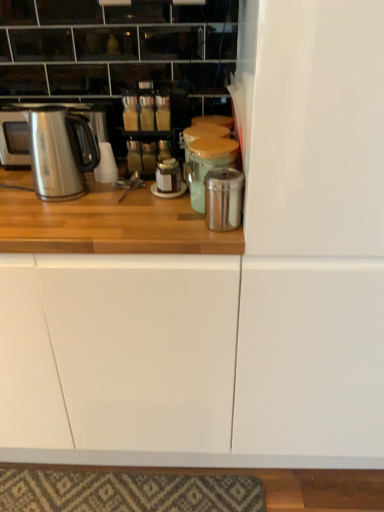
The image size is (384, 512). Identify the location of stainless steel kettle at left. (14, 138).

Where is `metallic silver fridge at center-right`? Image resolution: width=384 pixels, height=512 pixels. metallic silver fridge at center-right is located at coordinates (312, 231).

I want to click on the 2nd appliance in front of the stainless steel kettle at left, counting from the anchor's position, so click(223, 198).

Is stainless steel kettle at left bigger or smaller than shiny metallic canister at center, arranged as the first appliance when viewed from the front?

stainless steel kettle at left is bigger than shiny metallic canister at center, arranged as the first appliance when viewed from the front.

Does stainless steel kettle at left lie in front of shiny metallic canister at center, the 2th appliance viewed from the back?

No, the depth of stainless steel kettle at left is greater than that of shiny metallic canister at center, the 2th appliance viewed from the back.

Is shiny metallic canister at center, the 2th appliance viewed from the back, at the back of stainless steel kettle at left?

That's not correct — stainless steel kettle at left is not looking away from shiny metallic canister at center, the 2th appliance viewed from the back.

In the image, is metallic silver canister at center, which is counted as the 1th appliance, starting from the back, on the left side or the right side of shiny metallic canister at center, arranged as the first appliance when viewed from the front?

From the image, it's evident that metallic silver canister at center, which is counted as the 1th appliance, starting from the back, is to the left of shiny metallic canister at center, arranged as the first appliance when viewed from the front.

Does metallic silver canister at center, which is counted as the 1th appliance, starting from the back, touch shiny metallic canister at center, arranged as the first appliance when viewed from the front?

Yes, metallic silver canister at center, which is counted as the 1th appliance, starting from the back, is with shiny metallic canister at center, arranged as the first appliance when viewed from the front.

Consider the image. Which is nearer, (197,172) or (220,224)?

Point (197,172).

From the image's perspective, does metallic silver canister at center, which is counted as the 1th appliance, starting from the back, appear higher than shiny metallic canister at center, arranged as the first appliance when viewed from the front?

Yes, from the image's perspective, metallic silver canister at center, which is counted as the 1th appliance, starting from the back, is above shiny metallic canister at center, arranged as the first appliance when viewed from the front.

In order to click on fridge located underneath the stainless steel kettle at left (from a real-world perspective) in this screenshot , I will do `click(312, 231)`.

Considering the sizes of objects stainless steel kettle at left and metallic silver fridge at center-right in the image provided, who is thinner, stainless steel kettle at left or metallic silver fridge at center-right?

With smaller width is stainless steel kettle at left.

Are stainless steel kettle at left and metallic silver fridge at center-right making contact?

stainless steel kettle at left and metallic silver fridge at center-right are clearly separated.

Can we say stainless steel kettle at left lies outside metallic silver fridge at center-right?

stainless steel kettle at left lies outside metallic silver fridge at center-right's area.

Is metallic silver canister at center, which is counted as the 1th appliance, starting from the back, inside the boundaries of stainless steel kettle at left, or outside?

metallic silver canister at center, which is counted as the 1th appliance, starting from the back, lies outside stainless steel kettle at left.

Between metallic silver canister at center, the second appliance from the front, and stainless steel kettle at left, which one appears on the right side from the viewer's perspective?

From the viewer's perspective, metallic silver canister at center, the second appliance from the front, appears more on the right side.

Can you confirm if metallic silver canister at center, which is counted as the 1th appliance, starting from the back, is wider than stainless steel kettle at left?

In fact, metallic silver canister at center, which is counted as the 1th appliance, starting from the back, might be narrower than stainless steel kettle at left.

From a real-world perspective, does metallic silver canister at center, which is counted as the 1th appliance, starting from the back, sit lower than stainless steel kettle at left?

Yes, from a real-world perspective, metallic silver canister at center, which is counted as the 1th appliance, starting from the back, is under stainless steel kettle at left.

At what (x,y) coordinates should I click in order to perform the action: click on the 1st appliance behind the metallic silver fridge at center-right, counting from the anchor's position. Please return your answer as a coordinate pair (x, y). Looking at the image, I should click on (223, 198).

Is metallic silver fridge at center-right looking in the opposite direction of shiny metallic canister at center, the 2th appliance viewed from the back?

metallic silver fridge at center-right is not turned away from shiny metallic canister at center, the 2th appliance viewed from the back.

Between metallic silver fridge at center-right and shiny metallic canister at center, arranged as the first appliance when viewed from the front, which one appears on the left side from the viewer's perspective?

From the viewer's perspective, shiny metallic canister at center, arranged as the first appliance when viewed from the front, appears more on the left side.

Is metallic silver fridge at center-right taller or shorter than metallic silver canister at center, the second appliance from the front?

Clearly, metallic silver fridge at center-right is taller compared to metallic silver canister at center, the second appliance from the front.

From the image's perspective, is metallic silver fridge at center-right below metallic silver canister at center, which is counted as the 1th appliance, starting from the back?

Indeed, from the image's perspective, metallic silver fridge at center-right is shown beneath metallic silver canister at center, which is counted as the 1th appliance, starting from the back.

Between metallic silver fridge at center-right and metallic silver canister at center, the second appliance from the front, which one appears on the right side from the viewer's perspective?

metallic silver fridge at center-right.

Are shiny metallic canister at center, arranged as the first appliance when viewed from the front, and stainless steel kettle at left located far from each other?

No, shiny metallic canister at center, arranged as the first appliance when viewed from the front, is not far from stainless steel kettle at left.

Who is shorter, shiny metallic canister at center, arranged as the first appliance when viewed from the front, or stainless steel kettle at left?

shiny metallic canister at center, arranged as the first appliance when viewed from the front.

Is shiny metallic canister at center, the 2th appliance viewed from the back, thinner than stainless steel kettle at left?

Correct, the width of shiny metallic canister at center, the 2th appliance viewed from the back, is less than that of stainless steel kettle at left.

Relative to stainless steel kettle at left, is shiny metallic canister at center, arranged as the first appliance when viewed from the front, in front or behind?

shiny metallic canister at center, arranged as the first appliance when viewed from the front, is in front of stainless steel kettle at left.

Locate an element on the screen. The image size is (384, 512). the 2nd appliance counting from the right of the stainless steel kettle at left is located at coordinates (223, 198).

The image size is (384, 512). I want to click on appliance below the metallic silver canister at center, which is counted as the 1th appliance, starting from the back (from the image's perspective), so click(x=223, y=198).

Based on their spatial positions, is metallic silver canister at center, which is counted as the 1th appliance, starting from the back, or shiny metallic canister at center, arranged as the first appliance when viewed from the front, further from metallic silver fridge at center-right?

metallic silver canister at center, which is counted as the 1th appliance, starting from the back, is positioned further to the anchor metallic silver fridge at center-right.

Based on the photo, from the image, which object appears to be nearer to metallic silver fridge at center-right, metallic silver canister at center, which is counted as the 1th appliance, starting from the back, or stainless steel kettle at left?

metallic silver canister at center, which is counted as the 1th appliance, starting from the back.

From the image, which object appears to be farther from stainless steel kettle at left, shiny metallic canister at center, arranged as the first appliance when viewed from the front, or metallic silver fridge at center-right?

metallic silver fridge at center-right is positioned further to the anchor stainless steel kettle at left.

Looking at the image, which one is located further to metallic silver canister at center, the second appliance from the front, metallic silver fridge at center-right or stainless steel kettle at left?

stainless steel kettle at left is further to metallic silver canister at center, the second appliance from the front.

Which object lies nearer to the anchor point metallic silver canister at center, which is counted as the 1th appliance, starting from the back, stainless steel kettle at left or shiny metallic canister at center, the 2th appliance viewed from the back?

shiny metallic canister at center, the 2th appliance viewed from the back, lies closer to metallic silver canister at center, which is counted as the 1th appliance, starting from the back, than the other object.

Looking at the image, which one is located closer to metallic silver fridge at center-right, stainless steel kettle at left or metallic silver canister at center, which is counted as the 1th appliance, starting from the back?

metallic silver canister at center, which is counted as the 1th appliance, starting from the back, lies closer to metallic silver fridge at center-right than the other object.

When comparing their distances from shiny metallic canister at center, the 2th appliance viewed from the back, does metallic silver fridge at center-right or metallic silver canister at center, which is counted as the 1th appliance, starting from the back, seem further?

metallic silver fridge at center-right.

Estimate the real-world distances between objects in this image. Which object is further from shiny metallic canister at center, arranged as the first appliance when viewed from the front, metallic silver fridge at center-right or stainless steel kettle at left?

The object further to shiny metallic canister at center, arranged as the first appliance when viewed from the front, is stainless steel kettle at left.

The width and height of the screenshot is (384, 512). I want to click on appliance between stainless steel kettle at left and shiny metallic canister at center, the 2th appliance viewed from the back, from left to right, so coord(207,164).

This screenshot has height=512, width=384. I want to click on appliance located between metallic silver canister at center, which is counted as the 1th appliance, starting from the back, and metallic silver fridge at center-right in the left-right direction, so [x=223, y=198].